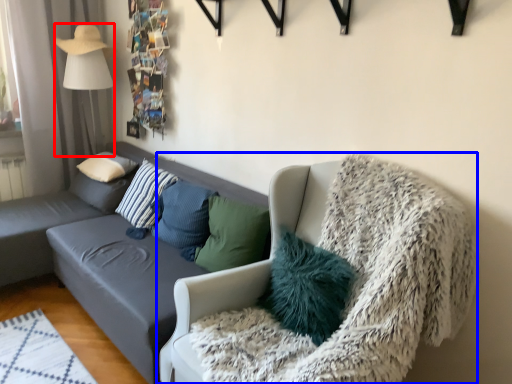
Question: Among these objects, which one is farthest to the camera, lamp (highlighted by a red box) or chair (highlighted by a blue box)?

Choices:
 (A) lamp
 (B) chair

Answer: (A)